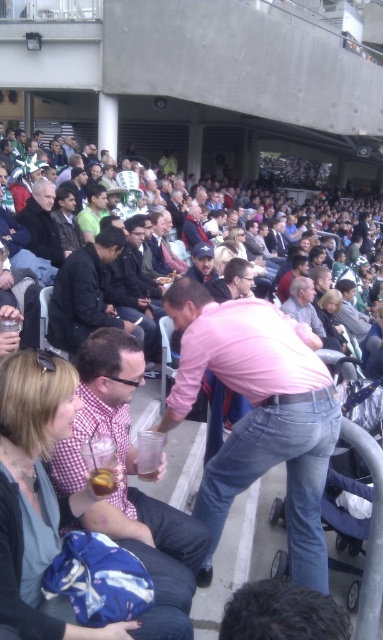
Who is positioned more to the right, checkered fabric shirt at center or dark brown leather jacket at upper left?

checkered fabric shirt at center is more to the right.

Locate an element on the screen. This screenshot has width=383, height=640. checkered fabric shirt at center is located at coordinates (58, 509).

This screenshot has width=383, height=640. Identify the location of checkered fabric shirt at center. (58, 509).

Is point (72, 326) in front of point (32, 250)?

Yes, it is.

Is dark blue jacket at center in front of dark brown leather jacket at upper left?

Yes.

Find the location of a particular element. dark blue jacket at center is located at coordinates (85, 292).

Between checkered fabric shirt at center and dark blue jacket at center, which one has more height?

Standing taller between the two is dark blue jacket at center.

Does checkered fabric shirt at center have a smaller size compared to dark blue jacket at center?

Yes, checkered fabric shirt at center is smaller than dark blue jacket at center.

Which is behind, point (18, 376) or point (57, 337)?

Positioned behind is point (57, 337).

Locate an element on the screen. This screenshot has height=640, width=383. checkered fabric shirt at center is located at coordinates tap(58, 509).